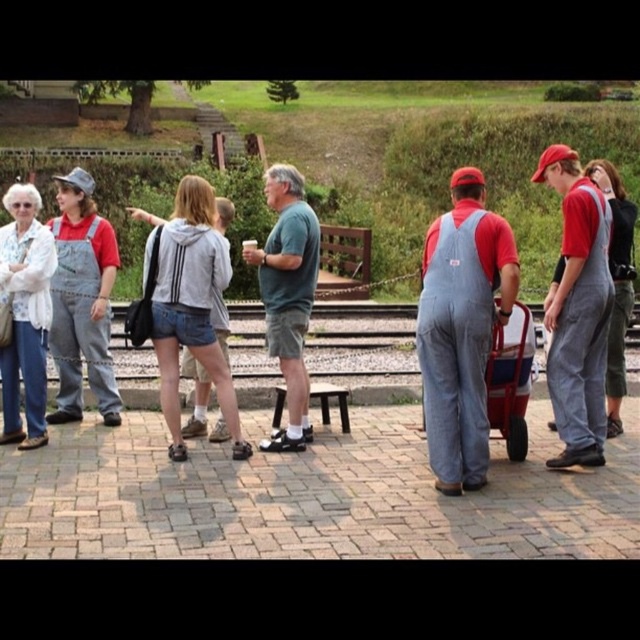
Based on the photo, you are a photographer trying to capture a wide shot of the metallic red cart at center and the denim shorts at center. Given that your camera can only focus on objects wider than 1.2 meters, will both items be in focus?

The denim shorts at center has a width less than 1.2 meters since it is narrower than the metallic red cart at center, which is also unknown. Therefore, it is uncertain if both will be in focus.

You are standing at the position of point (276, 358) and want to walk towards the grassy hill in the background. Is the point (81, 307) blocking your path?

Point (81, 307) is in front of point (276, 358), so it is blocking your path.

You are standing at the edge of the paved brick pathway and want to find the denim shorts at center. Which direction should you look to locate it?

The denim shorts at center is located at point [189,305], so you should look towards the center of the image to find it.